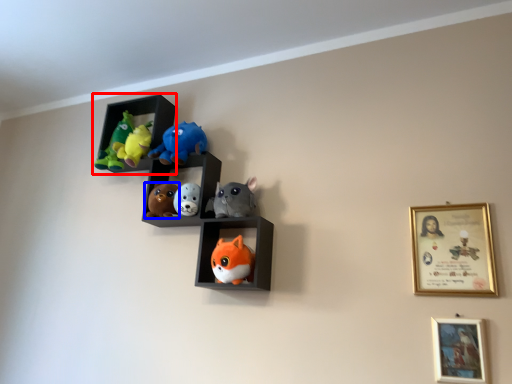
Question: Among these objects, which one is nearest to the camera, shelf (highlighted by a red box) or toy (highlighted by a blue box)?

Choices:
 (A) shelf
 (B) toy

Answer: (B)